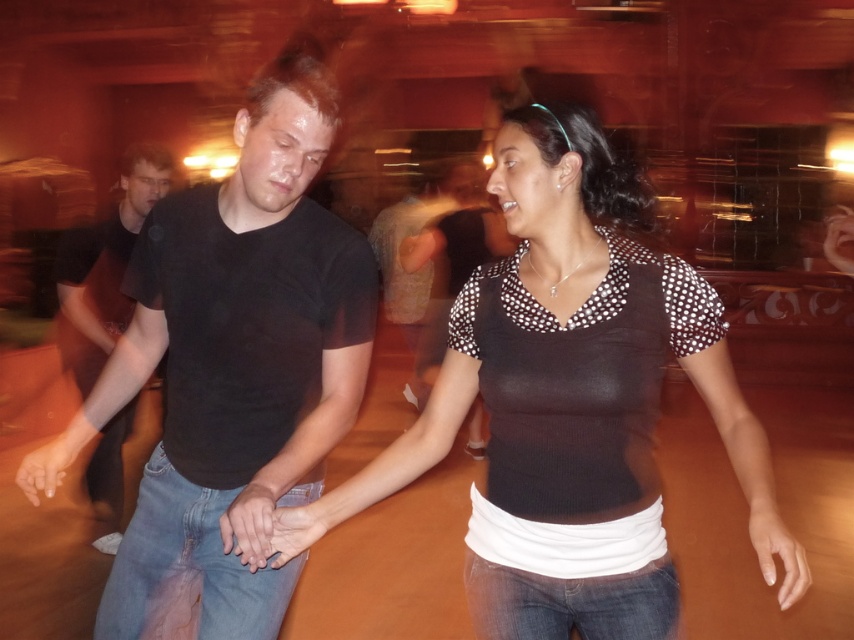
Between point (145, 596) and point (420, 417), which one is positioned behind?

The point (145, 596) is behind.

Which of these two, black matte t-shirt at center or black knitted top at center, stands shorter?

Standing shorter between the two is black knitted top at center.

Is point (173, 589) positioned in front of point (648, 276)?

No, it is behind (648, 276).

Where is `black matte t-shirt at center`? The image size is (854, 640). black matte t-shirt at center is located at coordinates (232, 372).

Can you confirm if black matte t-shirt at center is wider than black cotton shirt at left?

Indeed, black matte t-shirt at center has a greater width compared to black cotton shirt at left.

Who is shorter, black matte t-shirt at center or black cotton shirt at left?

black matte t-shirt at center

Image resolution: width=854 pixels, height=640 pixels. What do you see at coordinates (232, 372) in the screenshot?
I see `black matte t-shirt at center` at bounding box center [232, 372].

Identify the location of black matte t-shirt at center. (232, 372).

Between black knitted top at center and black cotton shirt at left, which one has less height?

Standing shorter between the two is black knitted top at center.

Consider the image. Is black knitted top at center below black cotton shirt at left?

No, black knitted top at center is not below black cotton shirt at left.

Between point (291, 532) and point (59, 253), which one is positioned behind?

Positioned behind is point (59, 253).

This screenshot has height=640, width=854. Identify the location of black knitted top at center. (562, 205).